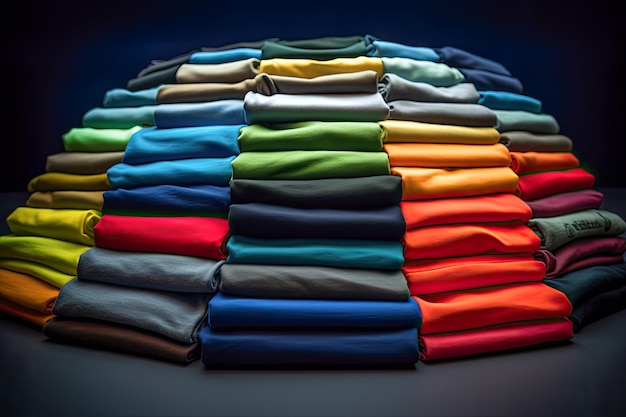
The image size is (626, 417). What are the coordinates of `green fabrics` in the screenshot? It's located at (51, 276), (56, 257), (265, 165), (265, 142), (115, 136), (583, 222), (421, 67).